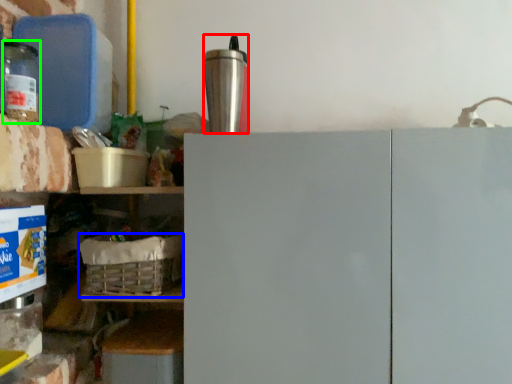
Question: Considering the real-world distances, which object is farthest from appliance (highlighted by a red box)? basket (highlighted by a blue box) or bottle (highlighted by a green box)?

Choices:
 (A) basket
 (B) bottle

Answer: (B)